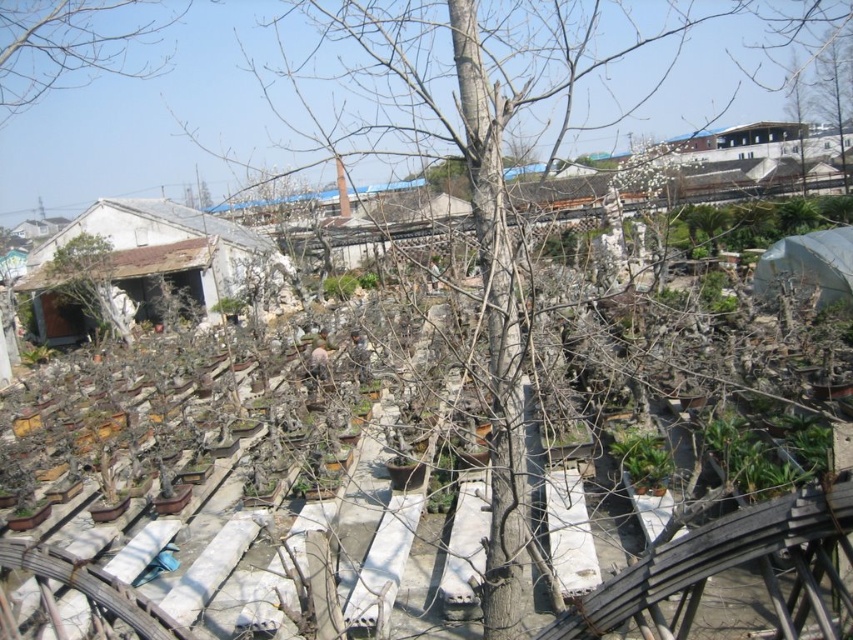
Is bare branches at upper left in front of brown wooden tree at center?

Yes, bare branches at upper left is closer to the viewer.

Which is above, bare branches at upper left or brown wooden tree at center?

bare branches at upper left is higher up.

You are a GUI agent. You are given a task and a screenshot of the screen. Output one action in this format:
    pyautogui.click(x=<x>, y=<y>)
    Task: Click on the bare branches at upper left
    Image resolution: width=853 pixels, height=640 pixels.
    Given the screenshot: What is the action you would take?
    pyautogui.click(x=74, y=44)